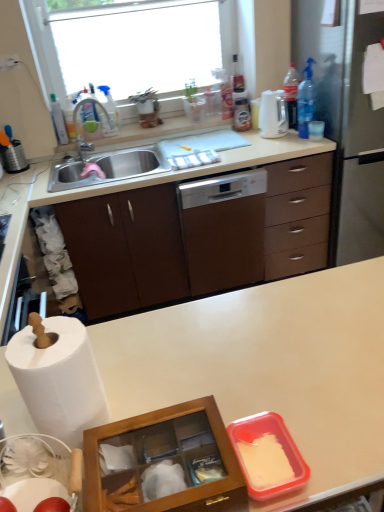
At what (x,y) coordinates should I click in order to perform the action: click on vacant space situated on the left part of blue translucent bottle at upper right, which ranks as the 1th bottle in right-to-left order. Please return your answer as a coordinate pair (x, y). This screenshot has width=384, height=512. Looking at the image, I should click on (283, 142).